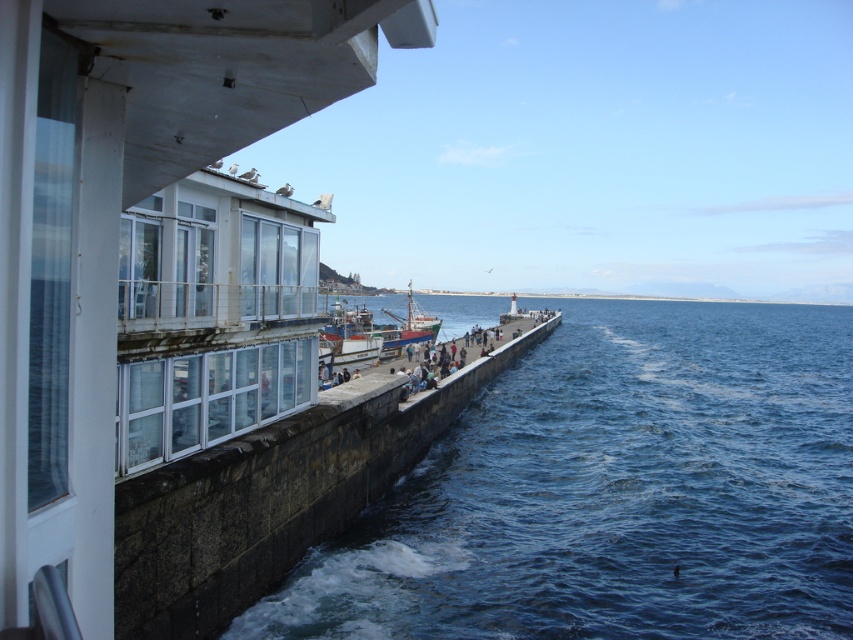
You are standing on the pier and want to take a photo of the blue water at center and the wooden boat at center. Which object should you focus on first if you want to capture both in the same frame without moving the camera?

You should focus on the wooden boat at center first because the blue water at center is in front of it, so keeping the boat in focus will ensure the water also appears sharp in the photo.

You are standing on the pier and want to walk towards the modern building with large glass windows. There are two points marked on the pier, point A at coordinates point A is point [445,593] and point B is point [473,353]. Which point should you head towards to get closer to the building?

You should head towards point A at coordinates point [445,593] because it is closer to the viewer, meaning it is physically nearer to your current position on the pier and thus closer to the modern building with large glass windows.